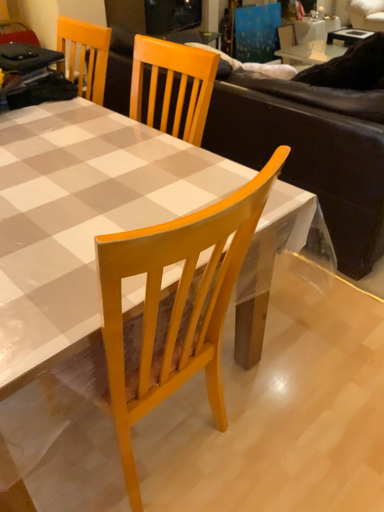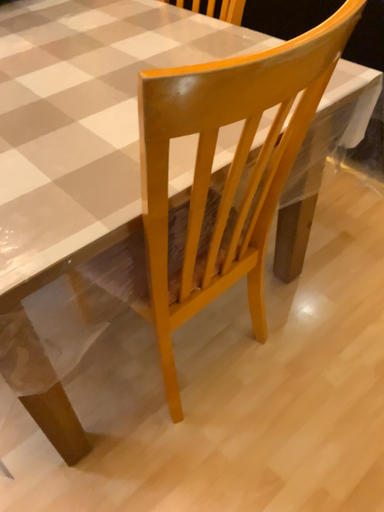
Question: How did the camera likely rotate when shooting the video?

Choices:
 (A) rotated upward
 (B) rotated downward

Answer: (B)